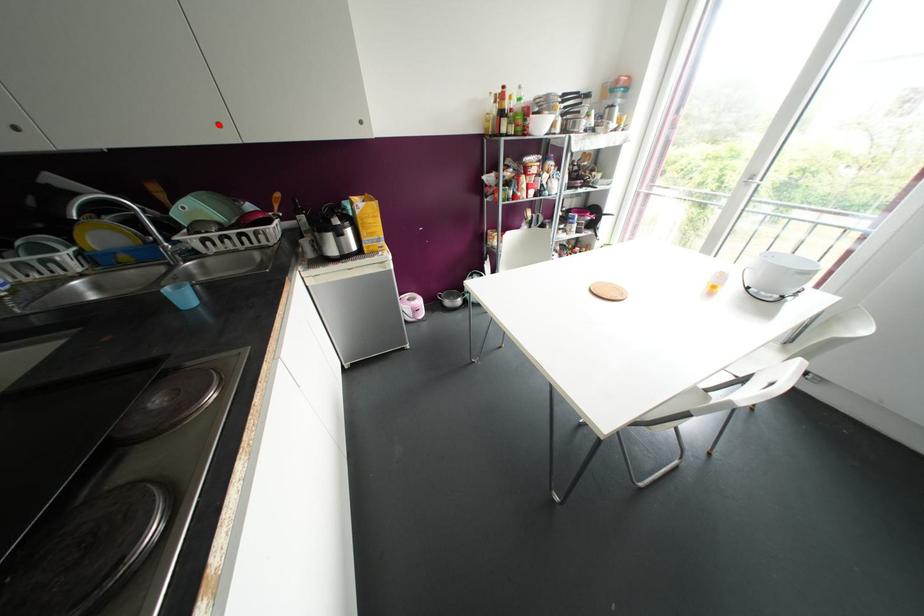
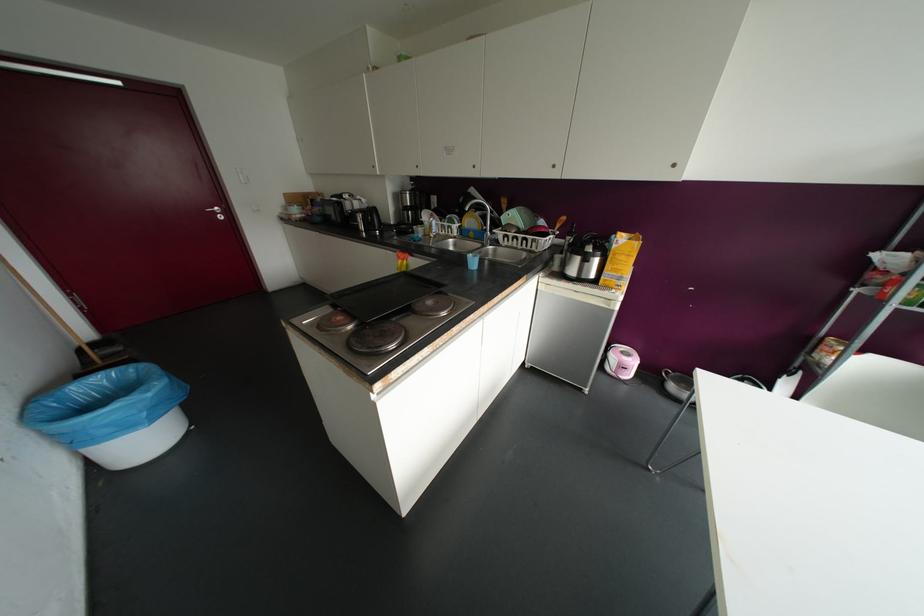
Where in the second image is the point corresponding to the highlighted location from the first image?

(553, 166)